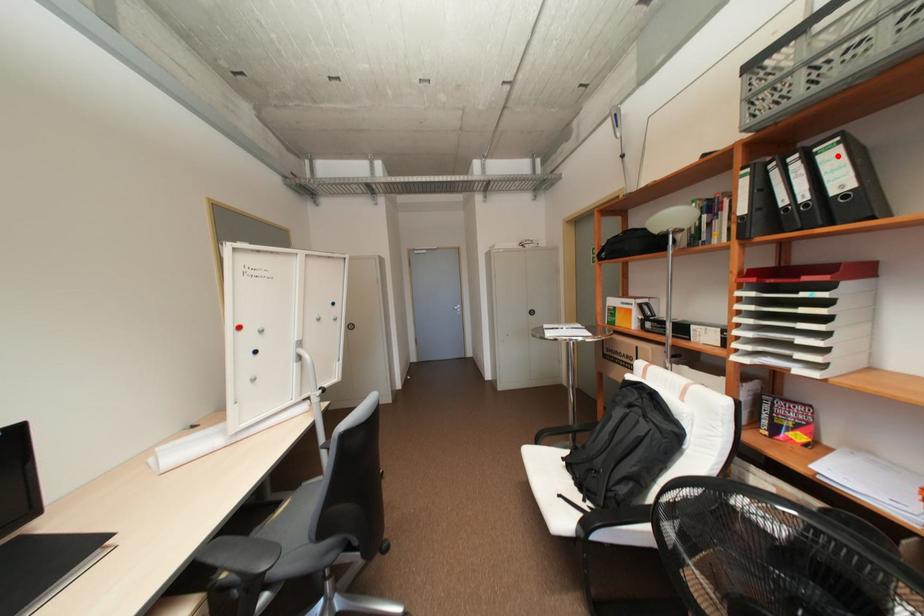
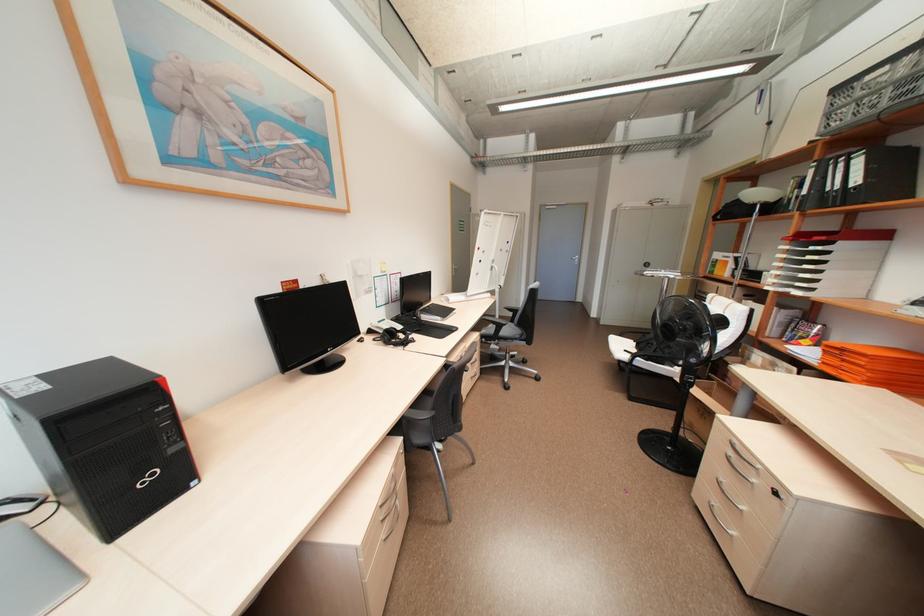
Find the pixel in the second image that matches the highlighted location in the first image.

(865, 161)